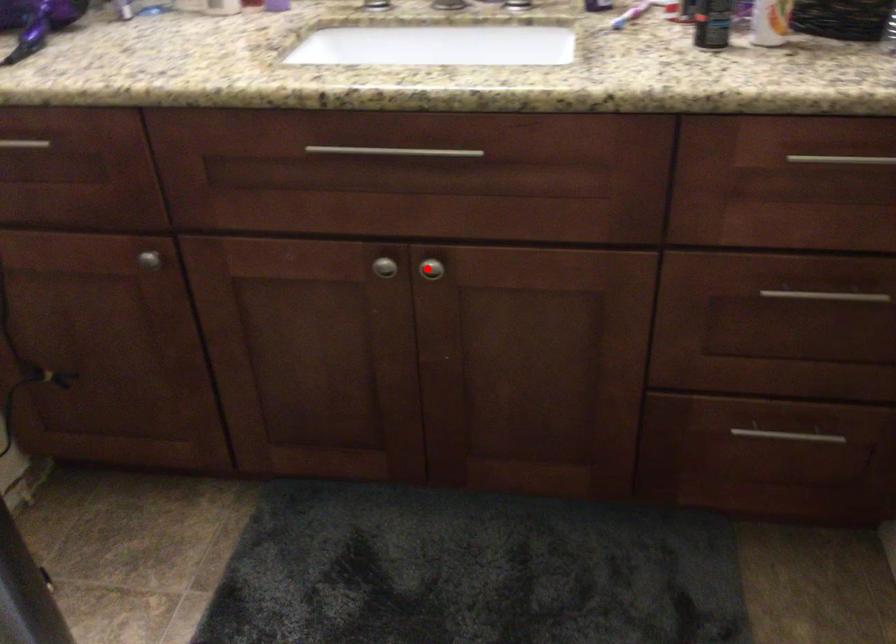
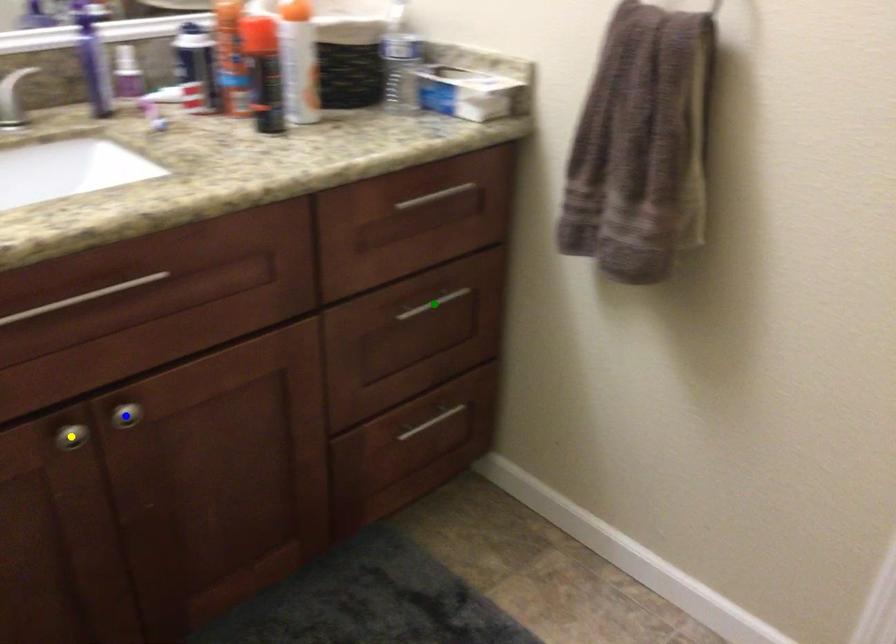
Question: I am providing you with two images of the same scene from different viewpoints. A red point is marked on the first image. You are given multiple points on the second image. Which spot in image 2 lines up with the point in image 1?

Choices:
 (A) blue point
 (B) green point
 (C) yellow point

Answer: (A)